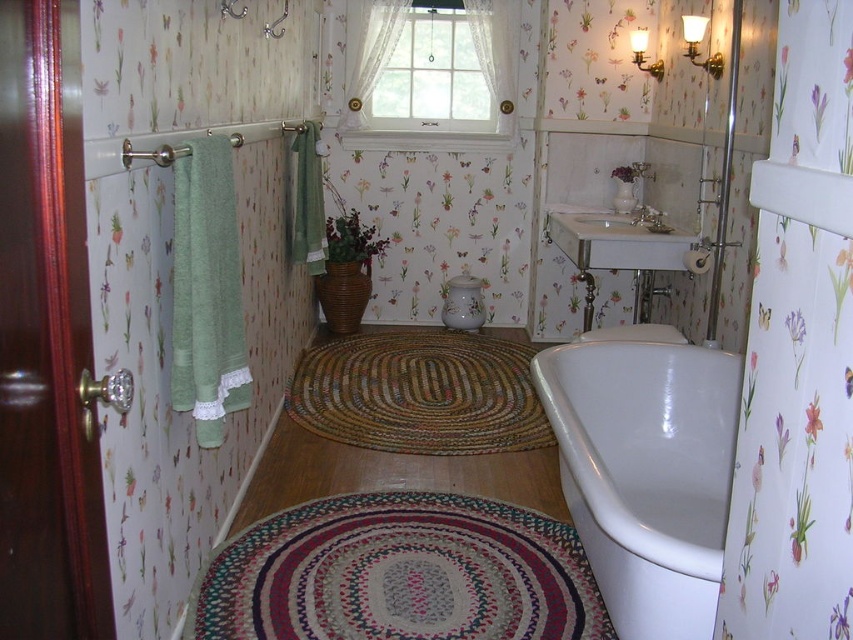
Question: Is white glossy bathtub at lower right to the right of white porcelain sink at center from the viewer's perspective?

Choices:
 (A) yes
 (B) no

Answer: (B)

Question: Does white glossy bathtub at lower right have a greater width compared to white porcelain sink at center?

Choices:
 (A) yes
 (B) no

Answer: (A)

Question: Which point is closer to the camera taking this photo?

Choices:
 (A) (596, 225)
 (B) (712, 456)

Answer: (B)

Question: Can you confirm if white glossy bathtub at lower right is positioned above white porcelain sink at center?

Choices:
 (A) no
 (B) yes

Answer: (A)